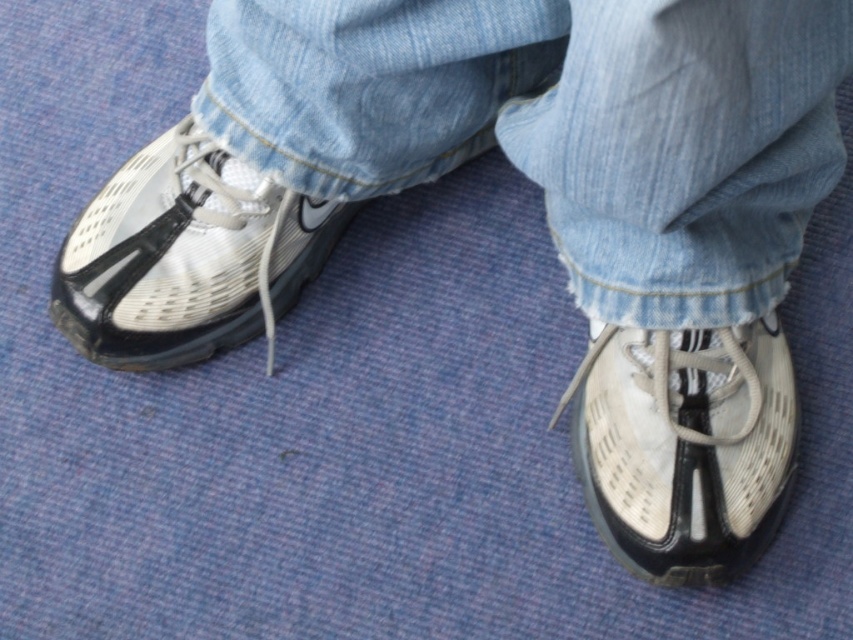
In the scene shown: Is denim at lower left smaller than white mesh shoe at lower right?

Incorrect, denim at lower left is not smaller in size than white mesh shoe at lower right.

Who is more distant from viewer, (619, 157) or (753, 346)?

The point (753, 346) is more distant.

Measure the distance between point (x=270, y=13) and camera.

They are 3.81 feet apart.

The width and height of the screenshot is (853, 640). I want to click on denim at lower left, so click(561, 124).

Who is positioned more to the left, white mesh shoe at lower right or shiny silver shoe at left?

shiny silver shoe at left is more to the left.

Is point (599, 365) behind point (219, 204)?

Yes, it is behind point (219, 204).

What are the coordinates of `white mesh shoe at lower right` in the screenshot? It's located at (683, 445).

Who is taller, denim at lower left or shiny silver shoe at left?

With more height is denim at lower left.

Is denim at lower left shorter than shiny silver shoe at left?

Incorrect, denim at lower left's height does not fall short of shiny silver shoe at left's.

Is point (724, 65) positioned in front of point (218, 218)?

Yes.

Find the location of `denim at lower left`. denim at lower left is located at coordinates (561, 124).